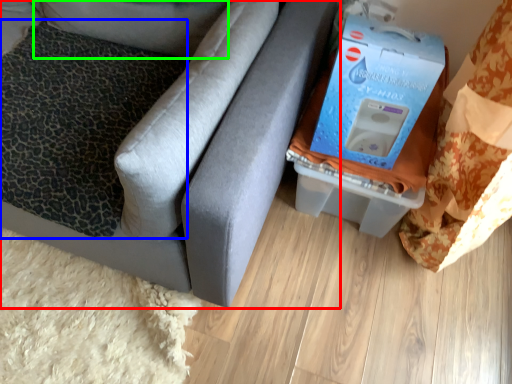
Question: Estimate the real-world distances between objects in this image. Which object is farther from furniture (highlighted by a red box), pillow (highlighted by a blue box) or pillow (highlighted by a green box)?

Choices:
 (A) pillow
 (B) pillow

Answer: (B)